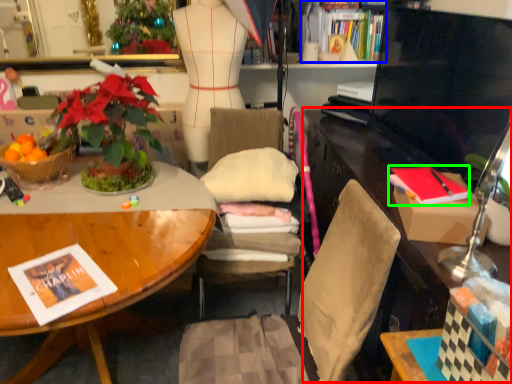
Question: Which is farther away from computer desk (highlighted by a red box)? book (highlighted by a blue box) or magazine (highlighted by a green box)?

Choices:
 (A) book
 (B) magazine

Answer: (A)